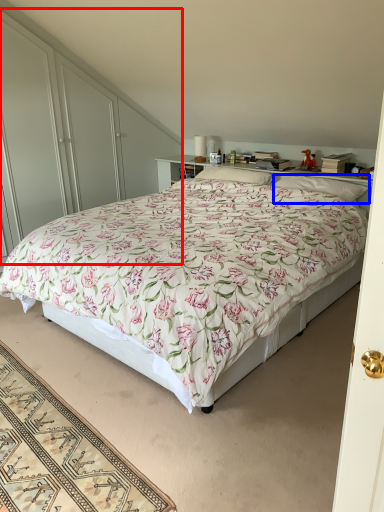
Question: Among these objects, which one is farthest to the camera, dresser (highlighted by a red box) or pillow (highlighted by a blue box)?

Choices:
 (A) dresser
 (B) pillow

Answer: (A)